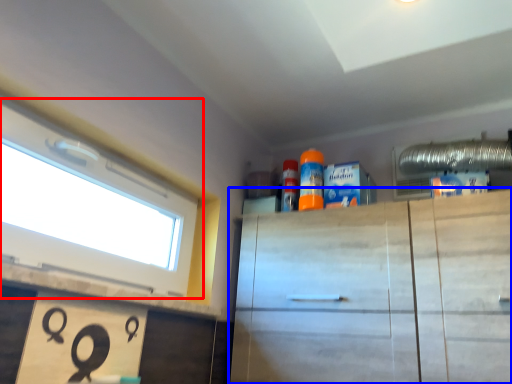
Question: Which point is closer to the camera, window (highlighted by a red box) or cabinetry (highlighted by a blue box)?

Choices:
 (A) window
 (B) cabinetry

Answer: (A)